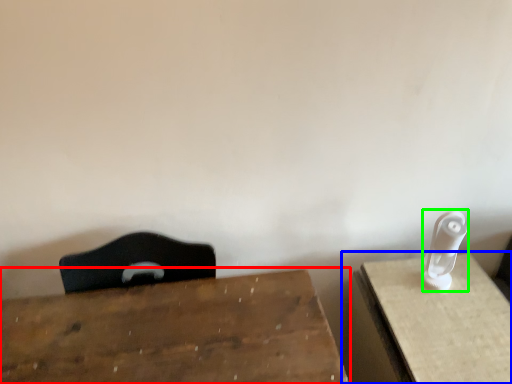
Question: Considering the real-world distances, which object is farthest from table (highlighted by a red box)? table (highlighted by a blue box) or Wii controller (highlighted by a green box)?

Choices:
 (A) table
 (B) Wii controller

Answer: (B)